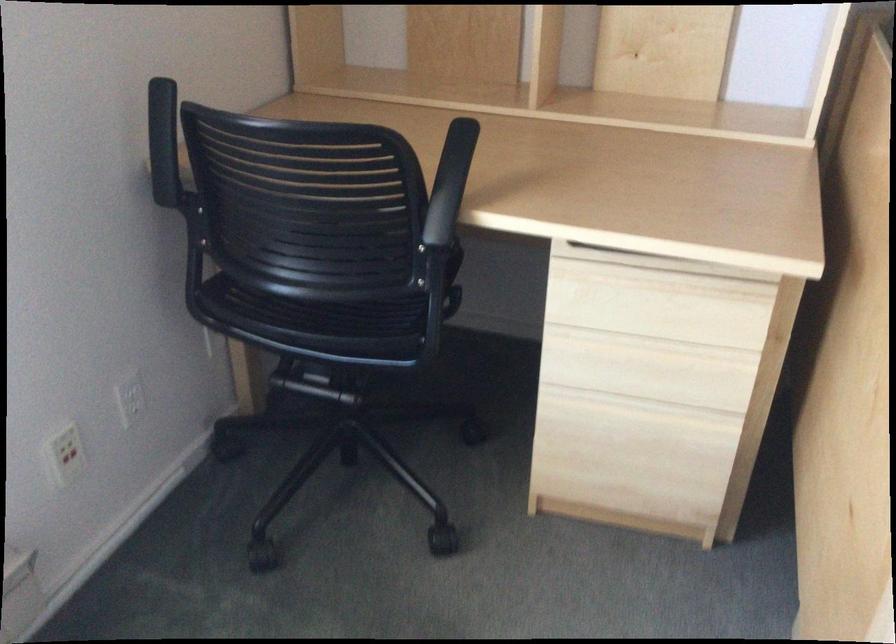
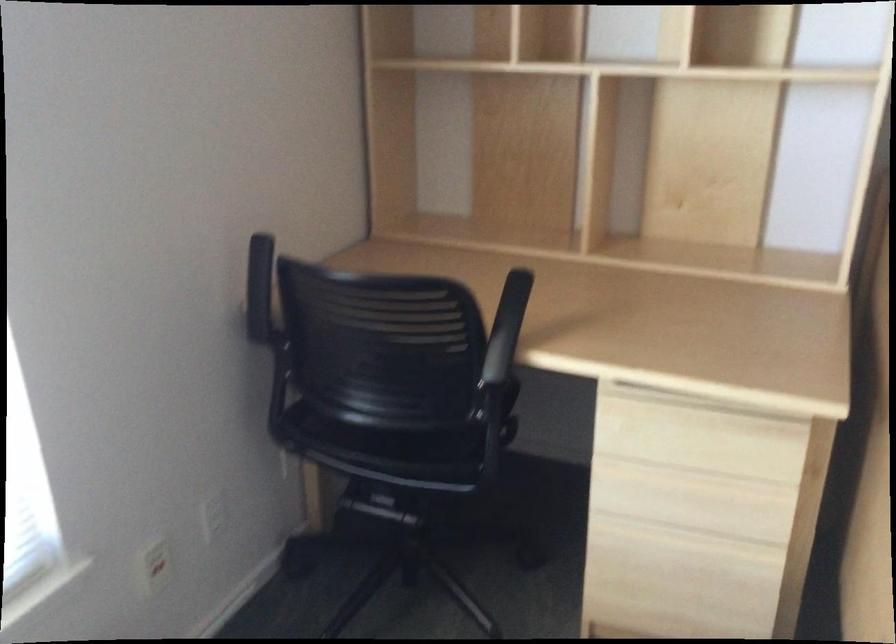
Question: The images are taken continuously from a first-person perspective. In which direction is your viewpoint rotating?

Choices:
 (A) Left
 (B) Right
 (C) Up
 (D) Down

Answer: (C)